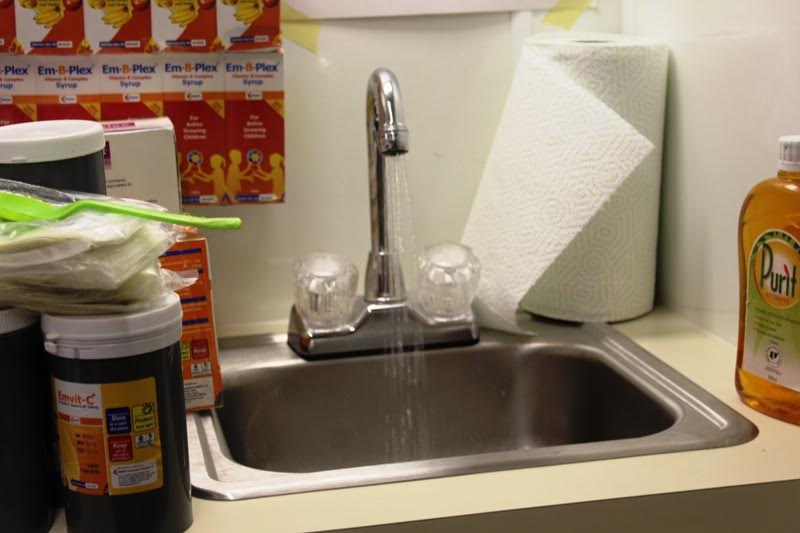
Image resolution: width=800 pixels, height=533 pixels. In order to click on handles in this screenshot , I will do `click(446, 273)`, `click(326, 290)`.